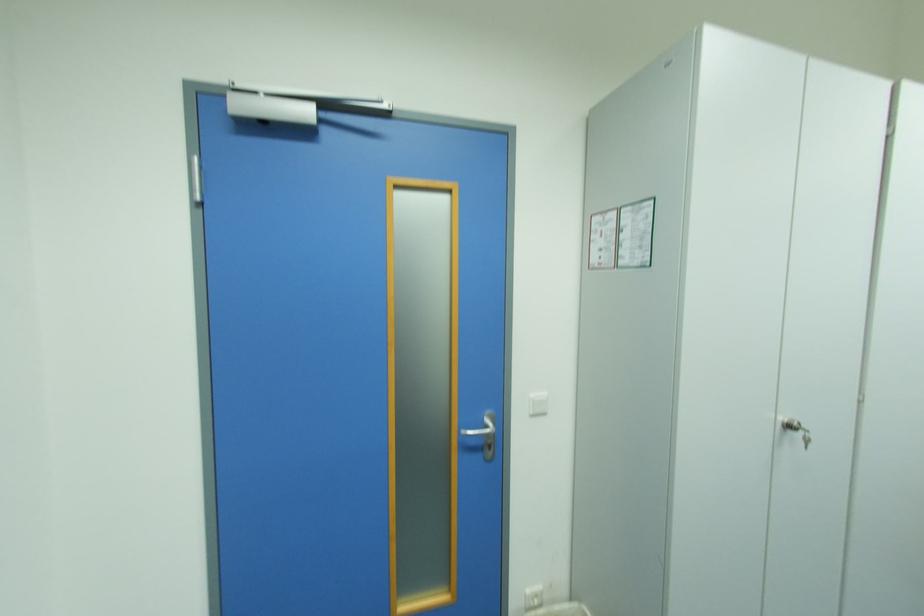
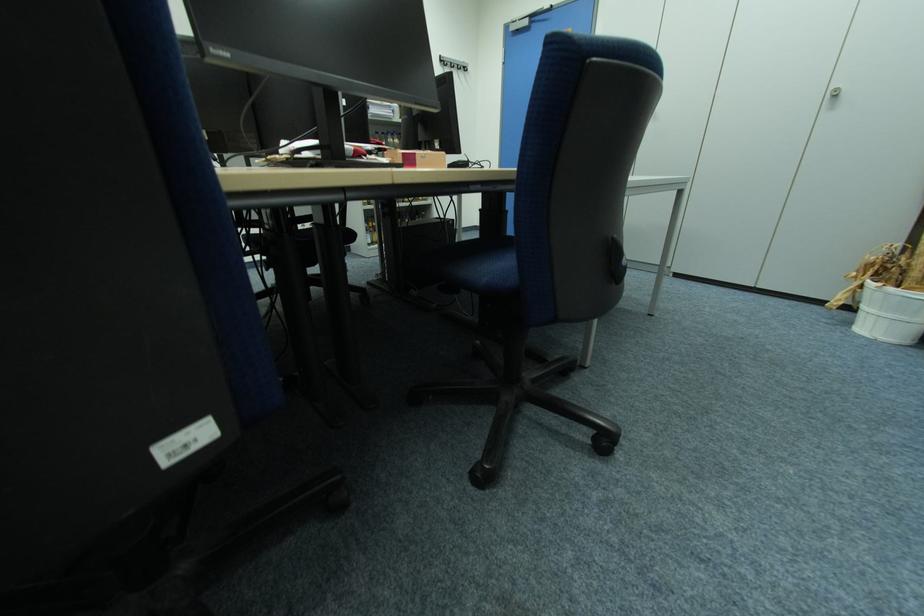
Question: I am providing you with two images of the same scene from different viewpoints. After the viewpoint changes to image2, which objects are now occluded?

Choices:
 (A) white cabinet handle
 (B) blue soap dish
 (C) white light switch
 (D) blue chair sitting surface

Answer: (C)